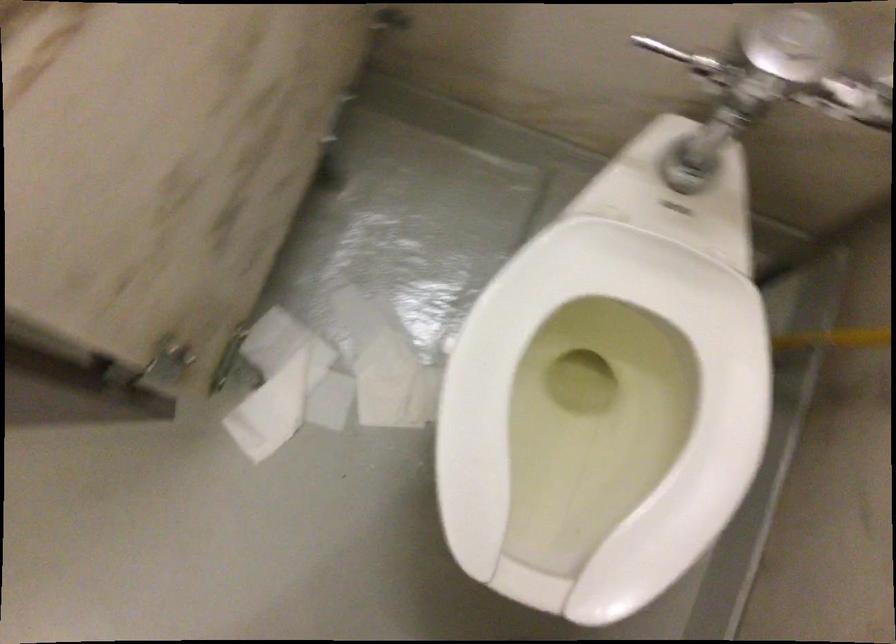
Find where to push the toilet flush lever. Please return your answer as a coordinate pair (x, y).

(688, 60)